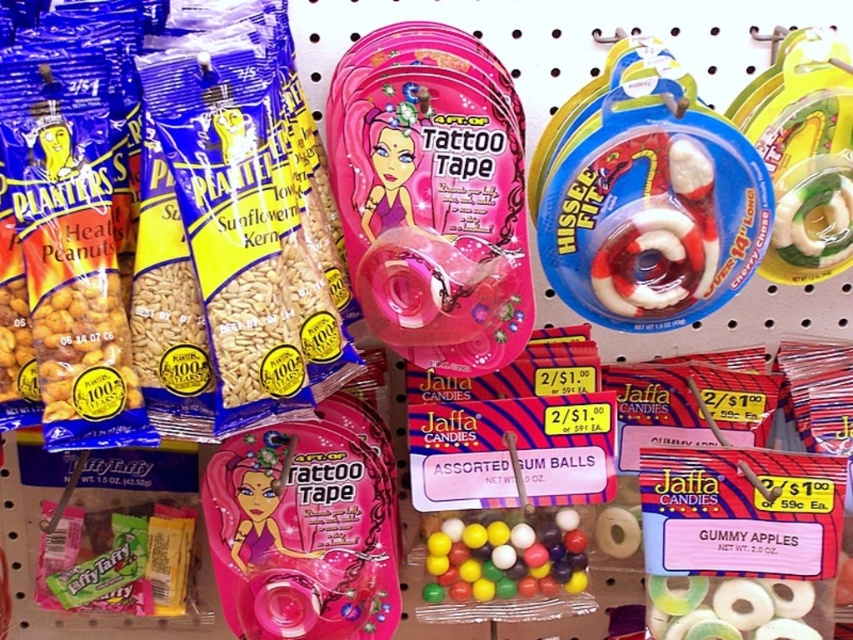
You are organizing items on a store shelf. You have a pink plastic tattoo tape at center and a white rubber ring at right. According to the store policy, items must be arranged so that heavier items are placed below lighter ones. Can you confirm if the current arrangement follows this rule?

The pink plastic tattoo tape at center is positioned under the white rubber ring at right. To determine if the arrangement follows the store policy, we need to know the weight of each item. Since the description does not provide weight information, we cannot confirm if heavier items are placed below lighter ones based on their current positions alone.

Consider the image. You are standing in front of the store shelf and want to reach the point at coordinates (395, 278). If your arm can extend 30 inches, can you reach it?

The point at coordinates (395, 278) is 33.55 inches away from the camera, which is farther than your arm can reach. You cannot reach it.